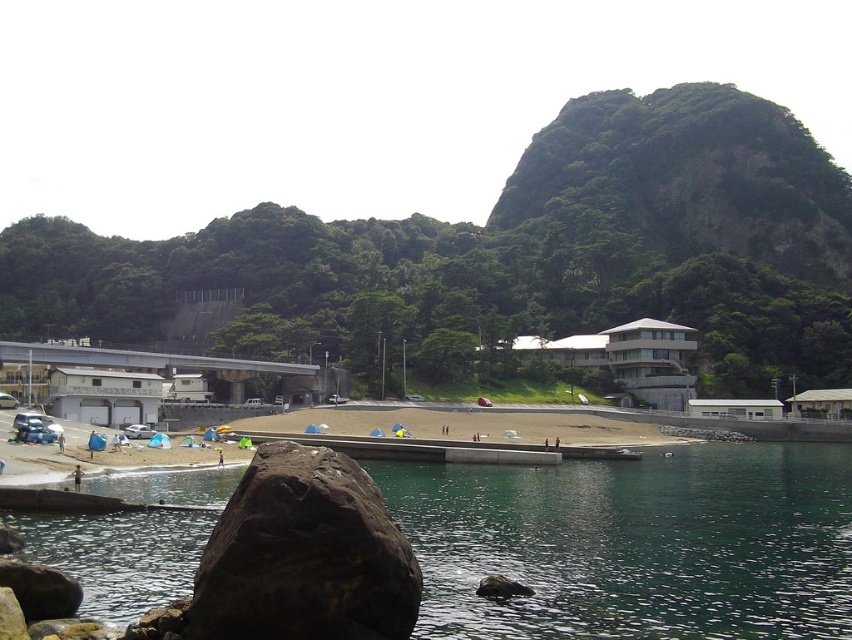
You are planning to swim from the clear water at lower center to the skinny person at lower left. Given that the average swimming speed is 2 meters per minute, how many minutes will it take you to reach them?

The clear water at lower center and the skinny person at lower left are 23.79 meters apart. At an average swimming speed of 2 meters per minute, it would take approximately 11.9 minutes to reach them.

You are standing at the beach and want to take a photo of the green leafy mountain at upper center. If your camera can focus up to 100 meters, will it be able to capture the mountain clearly?

The green leafy mountain at upper center is 90.06 meters away from camera, so yes, the camera can focus on it clearly since it is within the 100 meters range.